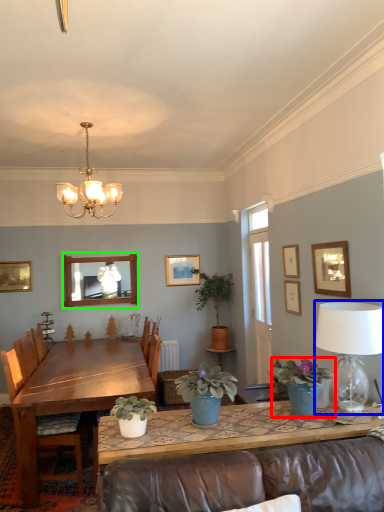
Question: Estimate the real-world distances between objects in this image. Which object is farther from houseplant (highlighted by a red box), table lamp (highlighted by a blue box) or mirror (highlighted by a green box)?

Choices:
 (A) table lamp
 (B) mirror

Answer: (B)